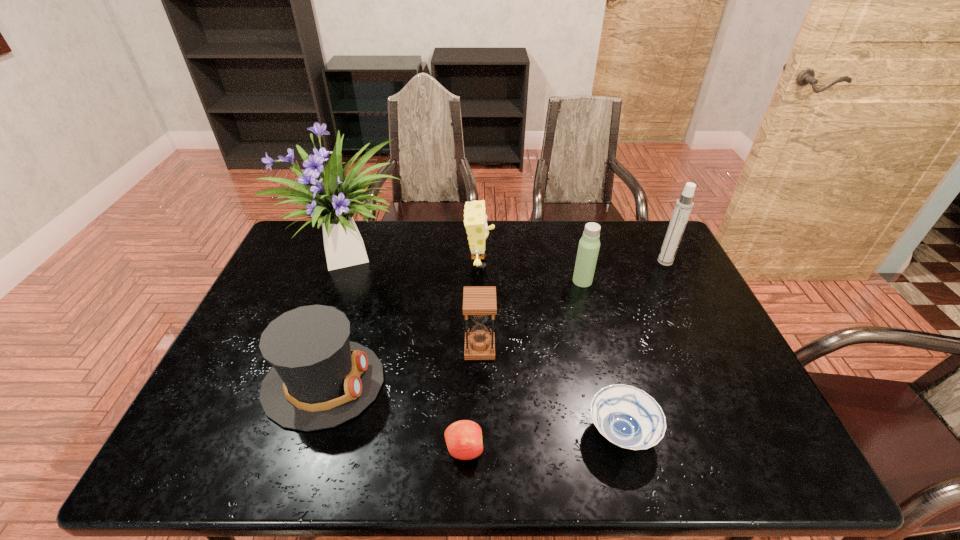
The image size is (960, 540). I want to click on flower arrangement, so click(x=336, y=199).

In order to click on aerosol can in this screenshot , I will do `click(684, 205)`.

Find the location of a particular element. The height and width of the screenshot is (540, 960). the rightmost object is located at coordinates (684, 205).

What are the coordinates of `thermos bottle` in the screenshot? It's located at (589, 244).

Locate an element on the screen. sponge is located at coordinates (475, 220).

Find the location of a particular element. hourglass is located at coordinates (479, 302).

Identify the location of dress hat. (319, 379).

Find the location of a particular element. apple is located at coordinates [x=463, y=438].

Locate an element on the screen. soup bowl is located at coordinates [x=628, y=417].

The width and height of the screenshot is (960, 540). I want to click on vacant space located 0.080m on the right of the flower arrangement, so click(x=440, y=258).